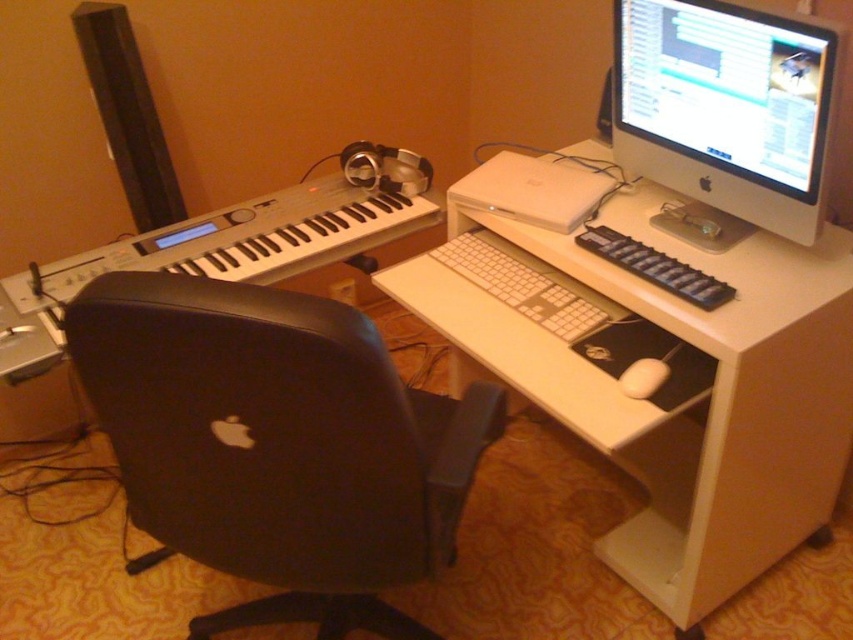
Question: Which point is farther to the camera?

Choices:
 (A) (432, 417)
 (B) (708, 588)

Answer: (B)

Question: Observing the image, what is the correct spatial positioning of black matte keyboard at left in reference to white plastic laptop at center?

Choices:
 (A) right
 (B) left

Answer: (B)

Question: Does white plastic computer desk at center have a larger size compared to white matte mouse at lower right?

Choices:
 (A) no
 (B) yes

Answer: (B)

Question: Which object appears closest to the camera in this image?

Choices:
 (A) white plastic computer desk at center
 (B) black leather swivel chair at center

Answer: (B)

Question: Is satin silver monitor at upper right below black matte keyboard at left?

Choices:
 (A) yes
 (B) no

Answer: (B)

Question: Which object is closer to the camera taking this photo?

Choices:
 (A) white plastic computer desk at center
 (B) satin silver monitor at upper right

Answer: (B)